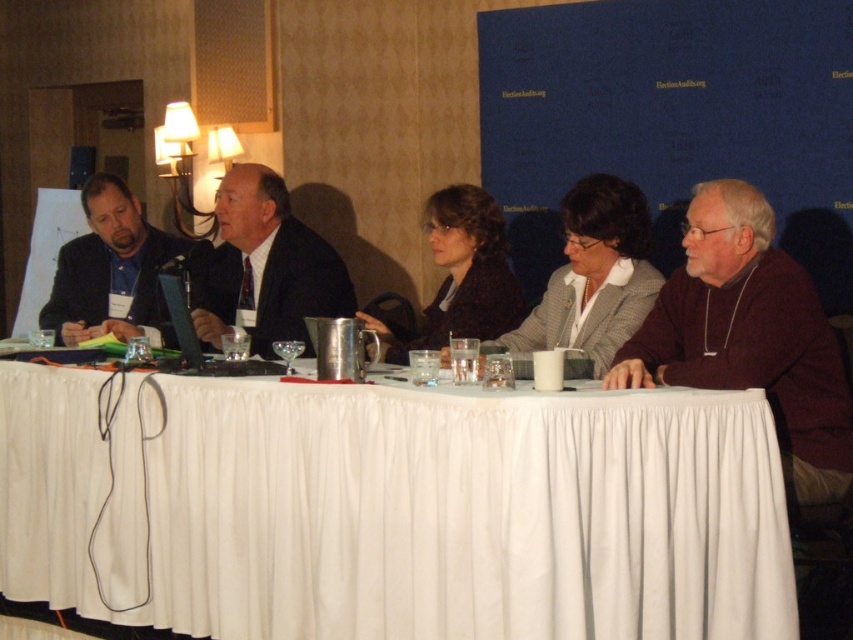
You are a photographer adjusting your camera to capture the panel discussion. You notice two points of interest marked at coordinates point (799, 296) and point (271, 230). Which point is closer to your camera lens?

Point (799, 296) is closer to the camera lens than point (271, 230).

You are organizing a panel discussion and need to ensure that all participants have enough space between their seats. You notice the matte black suit at left and the dark brown textured sweater at center. Which participant is wearing an article of clothing that is wider?

The matte black suit at left has a greater width than the dark brown textured sweater at center, so the participant wearing the matte black suit at left has a wider article of clothing.

You are a photographer at the event and need to adjust the lighting to ensure both the matte black suit at left and the dark brown textured sweater at center are well lit. Considering their sizes, which one might require more focused lighting to capture details effectively?

The matte black suit at left is bigger than the dark brown textured sweater at center, so it might require more focused lighting to capture details effectively due to its larger size.